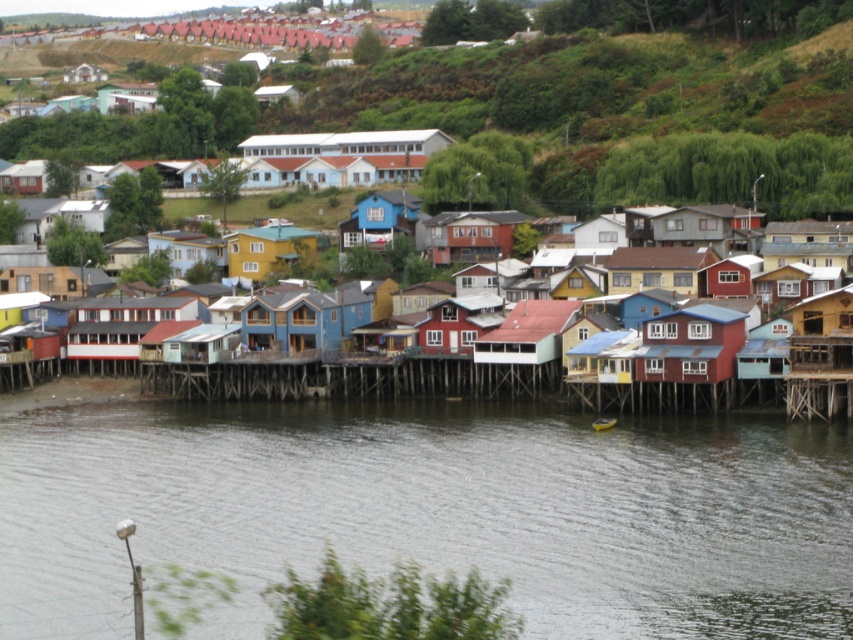
Based on the photo, is wooden stilt houses at center thinner than yellow matte house at center?

No, wooden stilt houses at center is not thinner than yellow matte house at center.

Does point (405, 356) come closer to viewer compared to point (247, 250)?

Yes, it is in front of point (247, 250).

Is point (141, 372) less distant than point (293, 225)?

Yes.

Locate an element on the screen. The height and width of the screenshot is (640, 853). wooden stilt houses at center is located at coordinates (461, 380).

Does wooden stilt houses at center have a greater height compared to red wood house at center?

Yes.

Can you confirm if wooden stilt houses at center is shorter than red wood house at center?

In fact, wooden stilt houses at center may be taller than red wood house at center.

Identify the location of wooden stilt houses at center. This screenshot has width=853, height=640. (461, 380).

Who is lower down, gray water at lower center or wooden stilt houses at center?

gray water at lower center

Is gray water at lower center thinner than wooden stilt houses at center?

Yes.

Who is more distant from viewer, (376, 420) or (448, 362)?

Positioned behind is point (448, 362).

Locate an element on the screen. The width and height of the screenshot is (853, 640). gray water at lower center is located at coordinates (433, 512).